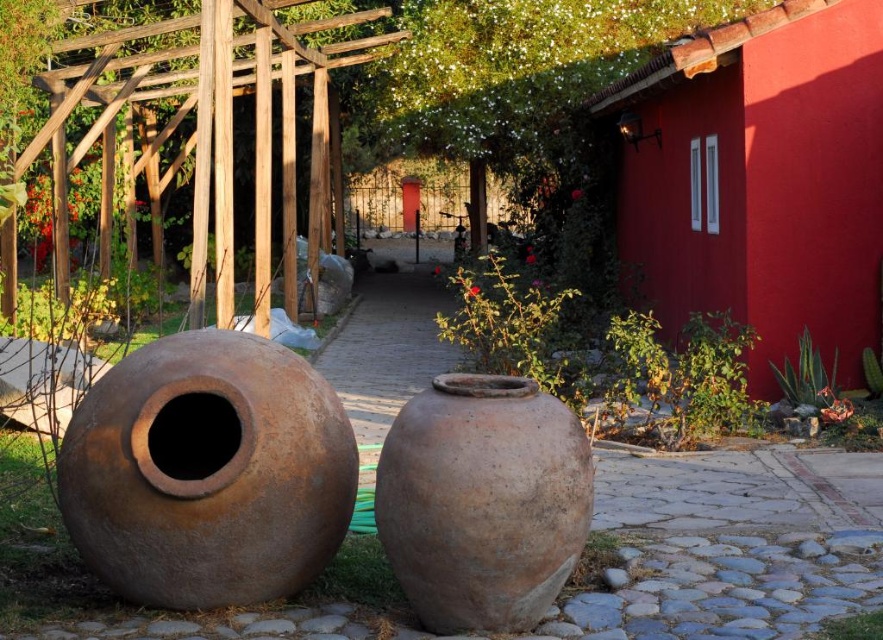
You are standing in the garden and want to place a new decorative item between the two points marked as point (96,556) and point (542,589). Which point is closer to you, so you can start arranging the item from there?

Point (96,556) is closer to you than point (542,589), so you should start arranging the item near point (96,556) first.

You are standing in the garden and want to reach the point marked at coordinates [215,513]. Considering the two large rustic terracotta pots in the foreground, which are part of the garden layout, can you estimate how far you need to walk to reach that point?

The point marked at coordinates [215,513] is 13.47 feet away from your current position, so you need to walk approximately 13.47 feet to reach it.

You are a gardener who needs to place a new plant between the rusty clay pot at left and the brown clay vase at center. The plant requires 3 feet of space to grow properly. Based on the scene, will there be enough space between them for the plant to grow?

The distance between the rusty clay pot at left and the brown clay vase at center is 34.62 inches, which is approximately 2.88 feet. Since the plant requires 3 feet of space, there isn